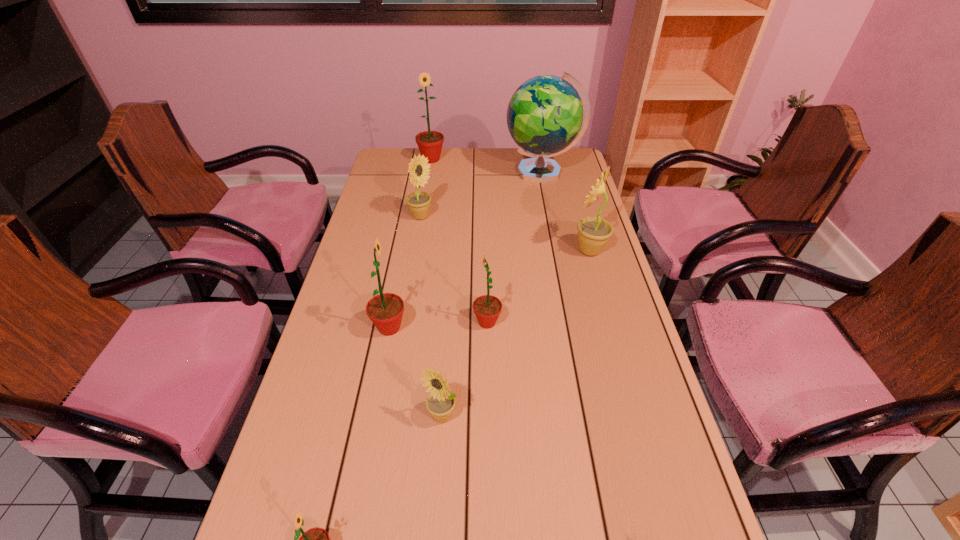
The image size is (960, 540). In order to click on blue globe in this screenshot , I will do `click(544, 116)`.

Locate an element on the screen. the farthest green sunflower is located at coordinates (430, 143).

You are a GUI agent. You are given a task and a screenshot of the screen. Output one action in this format:
    pyautogui.click(x=<x>, y=<y>)
    Task: Click on the farthest sunflower
    
    Given the screenshot: What is the action you would take?
    pyautogui.click(x=430, y=143)

Identify the location of the rightmost yellow sunflower. pyautogui.click(x=593, y=232).

Locate an element on the screen. This screenshot has width=960, height=540. the fourth farthest object is located at coordinates pos(593,232).

At what (x,y) coordinates should I click in order to perform the action: click on the second biggest green sunflower. Please return your answer as a coordinate pair (x, y). This screenshot has height=540, width=960. Looking at the image, I should click on (385, 310).

This screenshot has width=960, height=540. Find the location of `the sixth nearest object`. the sixth nearest object is located at coordinates (418, 202).

The height and width of the screenshot is (540, 960). I want to click on the leftmost yellow sunflower, so (418, 202).

Where is `the second sunflower from right to left`? This screenshot has width=960, height=540. the second sunflower from right to left is located at coordinates (487, 308).

I want to click on the rightmost green sunflower, so click(487, 308).